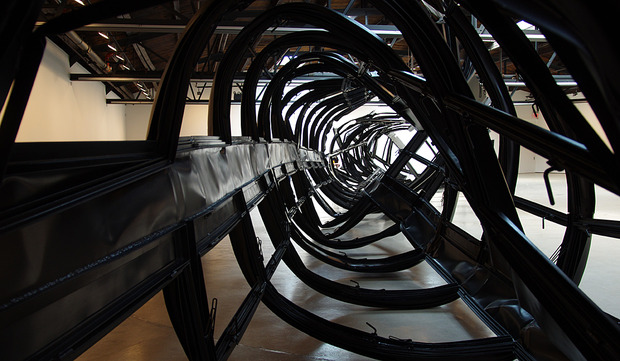
Where is `wall`? This screenshot has height=361, width=620. wall is located at coordinates tap(76, 93), tap(135, 121), tap(528, 149), tap(585, 107).